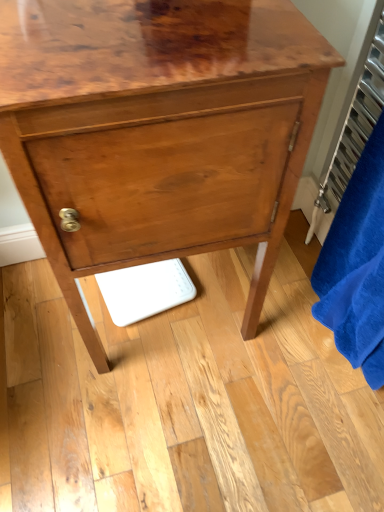
Where is `free space in front of glossy wood chest of drawers at center`? This screenshot has width=384, height=512. free space in front of glossy wood chest of drawers at center is located at coordinates (172, 430).